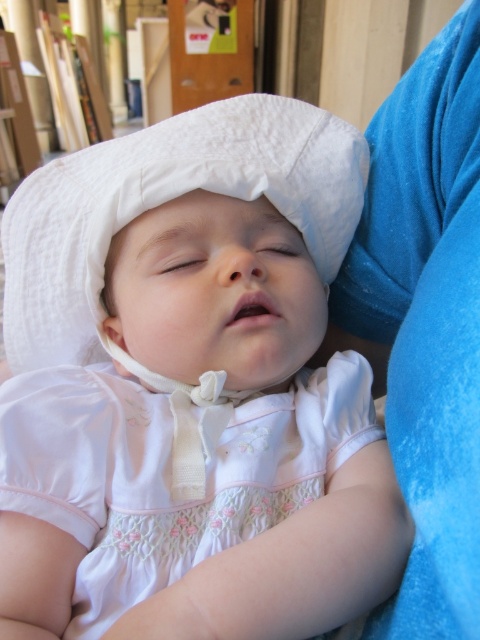
Question: Observing the image, what is the correct spatial positioning of white cotton bonnet at upper center in reference to white satin dress at center?

Choices:
 (A) right
 (B) left

Answer: (B)

Question: Considering the real-world distances, which object is closest to the white satin dress at center?

Choices:
 (A) white cotton bonnet at center
 (B) white cotton bonnet at upper center

Answer: (B)

Question: Which object is the farthest from the white cotton bonnet at upper center?

Choices:
 (A) white satin dress at center
 (B) white cotton bonnet at center

Answer: (A)

Question: Can you confirm if white satin dress at center is bigger than white cotton bonnet at center?

Choices:
 (A) yes
 (B) no

Answer: (B)

Question: Which of the following is the farthest from the observer?

Choices:
 (A) white satin dress at center
 (B) white cotton bonnet at upper center

Answer: (A)

Question: Does white cotton bonnet at upper center have a greater width compared to white satin dress at center?

Choices:
 (A) yes
 (B) no

Answer: (A)